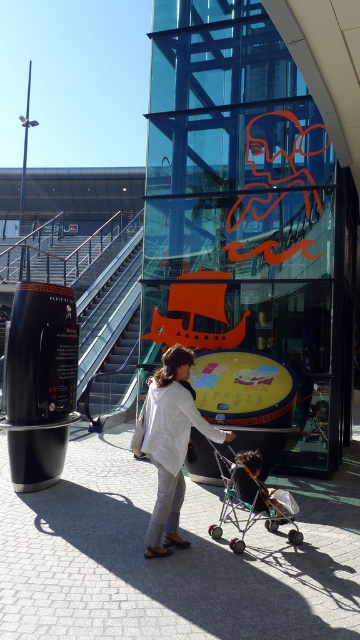
Is metallic silver escalator at center to the right of dark brown leather stroller at lower center from the viewer's perspective?

No, metallic silver escalator at center is not to the right of dark brown leather stroller at lower center.

Is metallic silver escalator at center above dark brown leather stroller at lower center?

Yes.

Between point (99, 358) and point (276, 525), which one is positioned in front?

Point (276, 525) is more forward.

You are a GUI agent. You are given a task and a screenshot of the screen. Output one action in this format:
    pyautogui.click(x=<x>, y=<y>)
    Task: Click on the metallic silver escalator at center
    
    Given the screenshot: What is the action you would take?
    pyautogui.click(x=108, y=310)

Between metallic silver stroller at center and dark brown leather stroller at lower center, which one has less height?

dark brown leather stroller at lower center

Does point (267, 524) come behind point (236, 472)?

Yes, point (267, 524) is behind point (236, 472).

Is point (257, 502) behind point (277, 509)?

No.

Where is `metallic silver stroller at center`? metallic silver stroller at center is located at coordinates (251, 499).

Is white matte jacket at center taller than white matte lab coat at center?

Yes, white matte jacket at center is taller than white matte lab coat at center.

Does white matte jacket at center have a lesser width compared to white matte lab coat at center?

No.

Is point (173, 419) positioned behind point (218, 429)?

No, (173, 419) is closer to viewer.

This screenshot has width=360, height=640. Identify the location of white matte jacket at center. (171, 444).